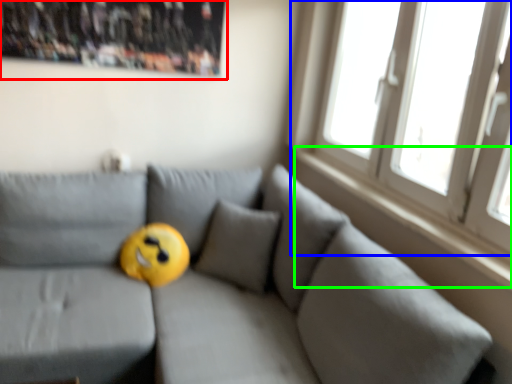
Question: Which object is the closest to the bulletin board (highlighted by a red box)? Choose among these: window (highlighted by a blue box) or window sill (highlighted by a green box).

Choices:
 (A) window
 (B) window sill

Answer: (A)